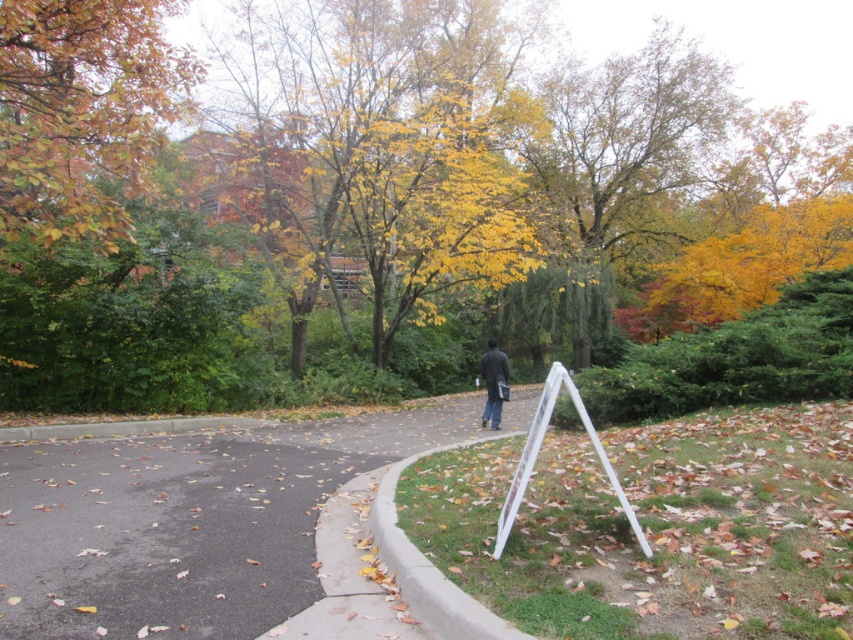
You are standing at the starting point of the path in the autumn park scene. You want to walk to the asphalt road at center. Which direction should you head?

You should head towards the point at coordinates (x=184, y=523) to reach the asphalt road at center.

You are standing at the start of the pathway in the park. You see the asphalt road at center and the dark gray jacket at center. Which object is closer to you?

The asphalt road at center is closer to you because it is in front of the dark gray jacket at center.